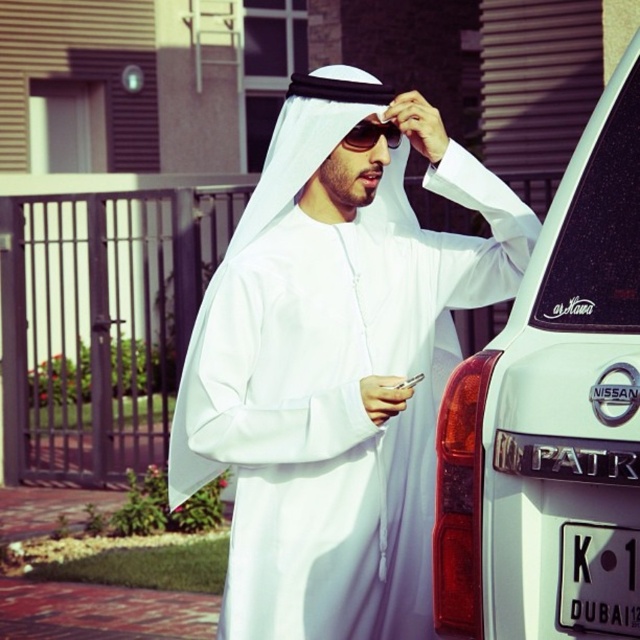
Consider the image. You are standing at the point marked by the coordinates point (449, 358) and want to walk towards the man in the white attire next to the white Nissan Patrol. How far will you have to walk to reach him?

The distance between point (449, 358) and the viewer is 4.81 meters, so you will have to walk 4.81 meters to reach the man in the white attire next to the white Nissan Patrol.

Consider the image. You are a delivery driver who needs to park your vehicle at the point marked by the coordinate point [397,276]. The parking space requires a minimum distance of 10 feet from the camera to avoid obstruction. Can you safely park there?

The point marked by the coordinate point [397,276] is 15.24 feet away from the camera, which exceeds the minimum required distance of 10 feet. Therefore, you can safely park there without obstructing the camera.